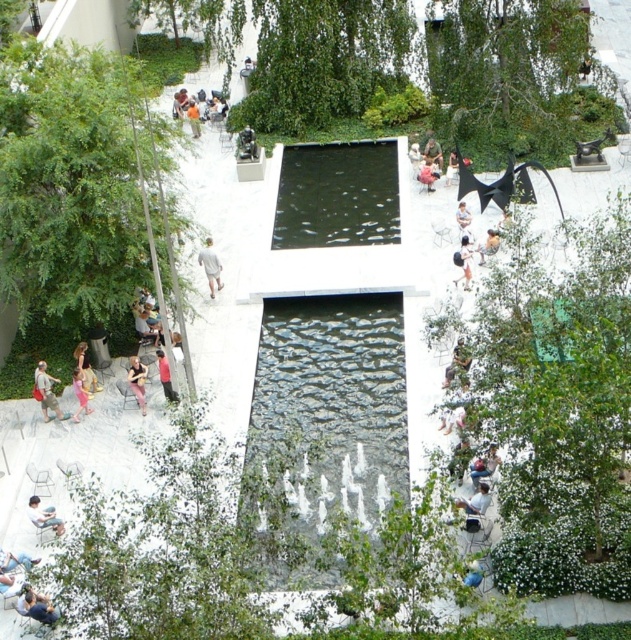
Can you confirm if light brown wooden chair at upper center is smaller than matte red bag at lower left?

No.

Does light brown wooden chair at upper center have a lesser height compared to matte red bag at lower left?

No.

Is point (196, 104) farther from camera compared to point (45, 392)?

Yes, it is behind point (45, 392).

This screenshot has height=640, width=631. In order to click on light brown wooden chair at upper center in this screenshot , I will do `click(187, 109)`.

Who is higher up, green leafy tree at upper center or matte red bag at lower left?

green leafy tree at upper center is higher up.

Measure the distance between green leafy tree at upper center and matte red bag at lower left.

The distance of green leafy tree at upper center from matte red bag at lower left is 15.84 meters.

Which is in front, point (510, 365) or point (57, 417)?

Point (510, 365) is in front.

The height and width of the screenshot is (640, 631). In order to click on green leafy tree at upper center in this screenshot , I will do `click(558, 368)`.

Is green leafy tree at upper center above pink fabric dress at lower left?

Yes, green leafy tree at upper center is above pink fabric dress at lower left.

Does green leafy tree at upper center have a greater height compared to pink fabric dress at lower left?

Indeed, green leafy tree at upper center has a greater height compared to pink fabric dress at lower left.

Describe the element at coordinates (558, 368) in the screenshot. The width and height of the screenshot is (631, 640). I see `green leafy tree at upper center` at that location.

The height and width of the screenshot is (640, 631). I want to click on green leafy tree at upper center, so click(558, 368).